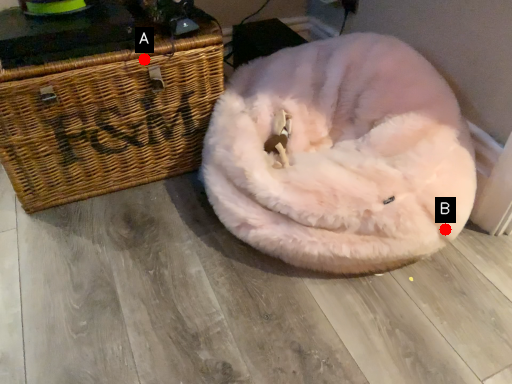
Question: Two points are circled on the image, labeled by A and B beside each circle. Which point is closer to the camera taking this photo?

Choices:
 (A) A is closer
 (B) B is closer

Answer: (B)